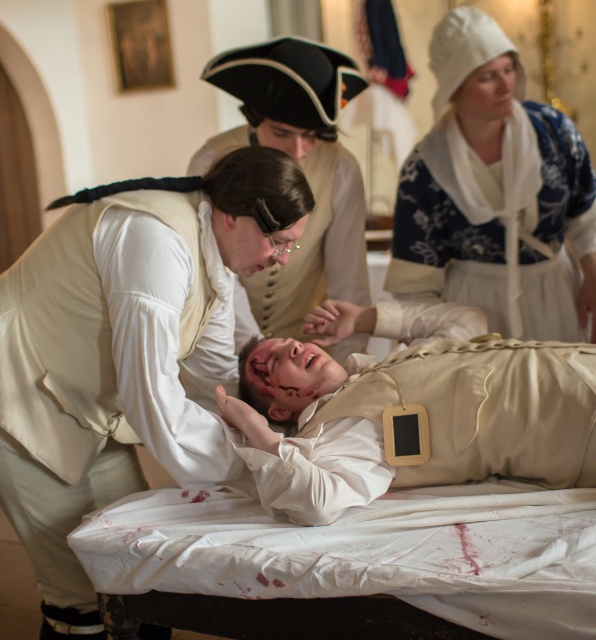
In the scene shown: In the historical scene, there is a beige fabric baby at center and a matte black hat at center. Which object is shorter?

The beige fabric baby at center is shorter than the matte black hat at center.